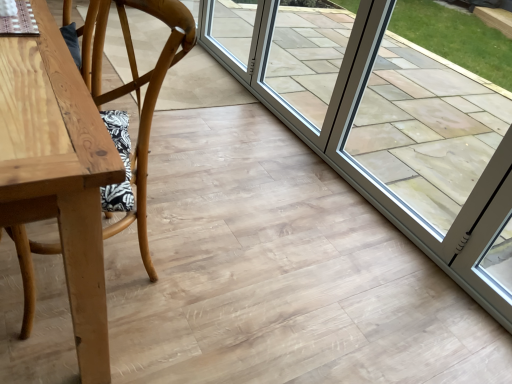
Image resolution: width=512 pixels, height=384 pixels. I want to click on vacant space that is in between clear glass door at center and wooden chair at left, so click(x=229, y=158).